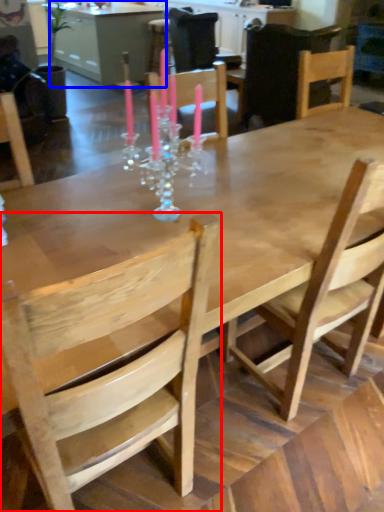
Question: Which object appears closest to the camera in this image, chair (highlighted by a red box) or table (highlighted by a blue box)?

Choices:
 (A) chair
 (B) table

Answer: (A)